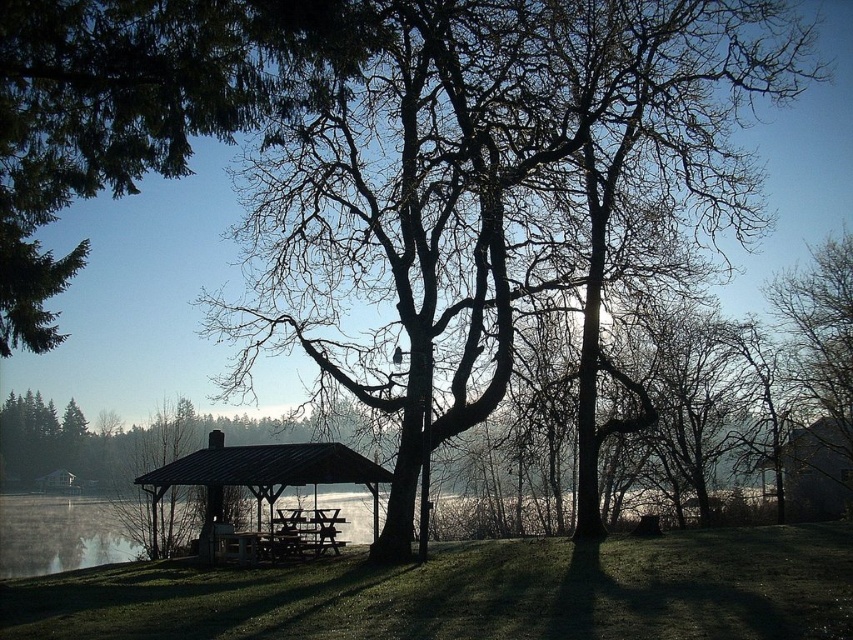
Based on the photo, you are planning to set up a small tent for a picnic. The tent requires a flat area that is wider than the wooden picnic table at center. Is there enough space near the clear water at center to set up your tent?

The clear water at center might be wider than the wooden picnic table at center, so there could be enough space to set up the tent near the clear water at center.

You are standing at the picnic table inside the shelter. You want to walk to the clear water at center. Which direction should you walk?

You should walk towards the center of the image to reach the clear water at center, as it is located at point coordinates (x=59, y=534).